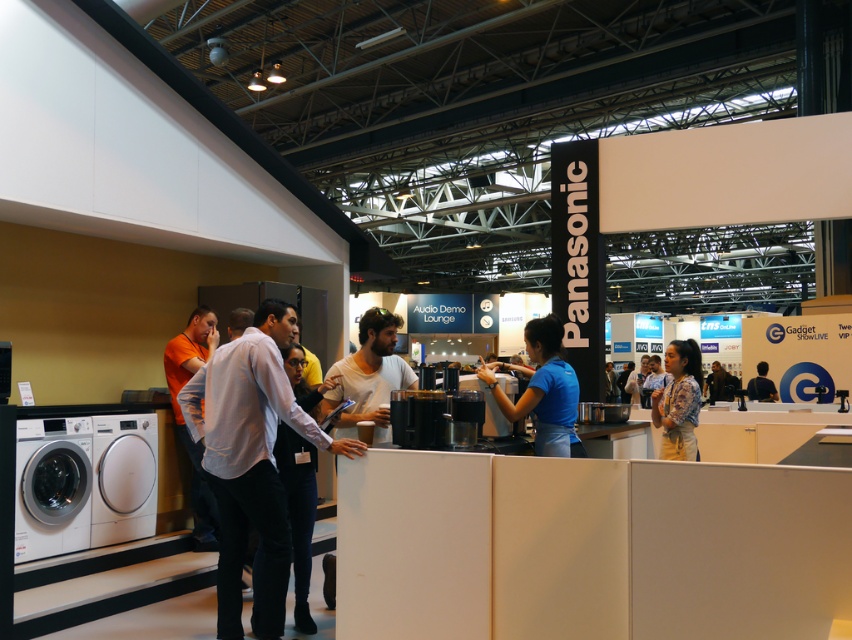
Is white shirt at center smaller than printed fabric blouse at center?

Incorrect, white shirt at center is not smaller in size than printed fabric blouse at center.

Between white shirt at center and printed fabric blouse at center, which one appears on the right side from the viewer's perspective?

printed fabric blouse at center

This screenshot has height=640, width=852. What are the coordinates of `white shirt at center` in the screenshot? It's located at (251, 460).

Locate an element on the screen. white shirt at center is located at coordinates (251, 460).

Can you confirm if white glossy washing machine at lower left is positioned above dark blue shirt at center?

Incorrect, white glossy washing machine at lower left is not positioned above dark blue shirt at center.

Who is more distant from viewer, (133, 486) or (764, 388)?

The point (764, 388) is more distant.

In order to click on white glossy washing machine at lower left in this screenshot , I will do `click(124, 477)`.

Which of these two, white shirt at center or satin silver washer at lower left, stands taller?

Standing taller between the two is white shirt at center.

Does white shirt at center appear on the left side of satin silver washer at lower left?

In fact, white shirt at center is to the right of satin silver washer at lower left.

Between point (266, 611) and point (84, 445), which one is positioned in front?

Positioned in front is point (266, 611).

Where is `white shirt at center`? This screenshot has height=640, width=852. white shirt at center is located at coordinates (251, 460).